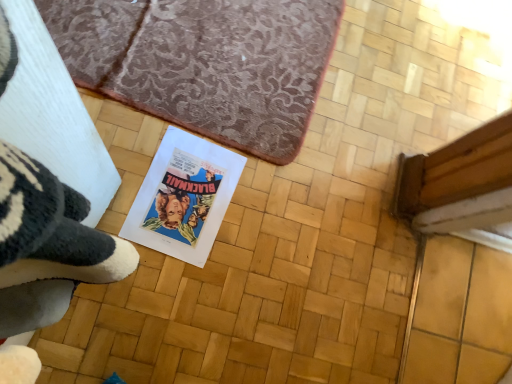
Image resolution: width=512 pixels, height=384 pixels. What are the coordinates of `vacant space in matte paper book at center (from a real-world perspective)` in the screenshot? It's located at (185, 201).